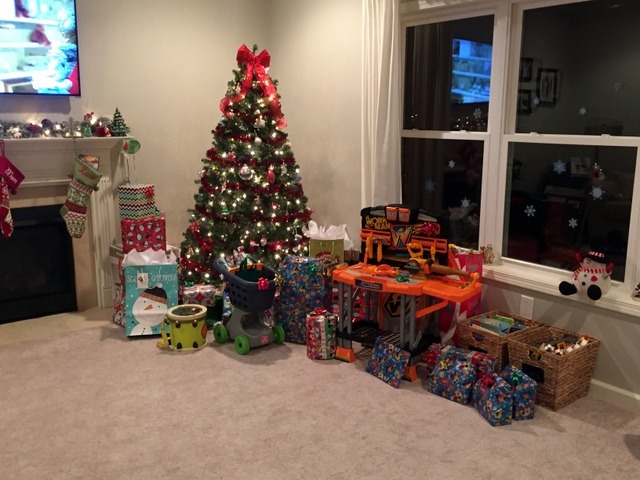
Locate an element on the screen. white wall is located at coordinates [201, 69].